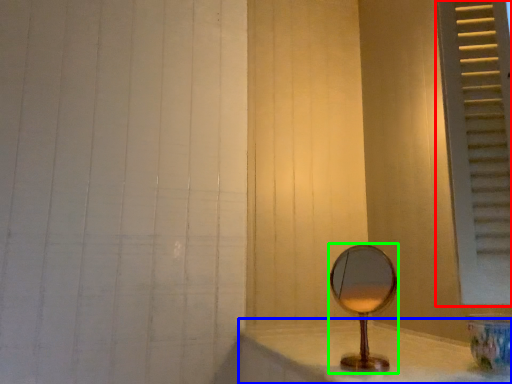
Question: Based on their relative distances, which object is nearer to window frame (highlighted by a red box)? Choose from counter top (highlighted by a blue box) and mirror (highlighted by a green box).

Choices:
 (A) counter top
 (B) mirror

Answer: (B)